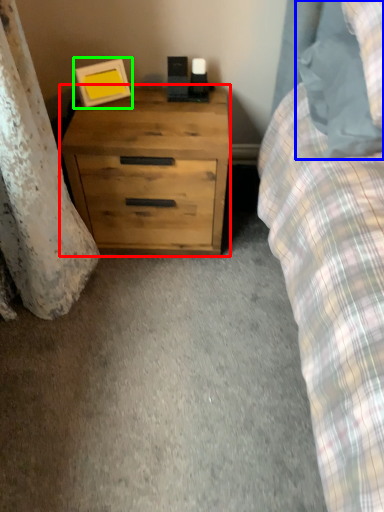
Question: Considering the real-world distances, which object is closest to chest of drawers (highlighted by a red box)? pillow (highlighted by a blue box) or picture frame (highlighted by a green box).

Choices:
 (A) pillow
 (B) picture frame

Answer: (B)